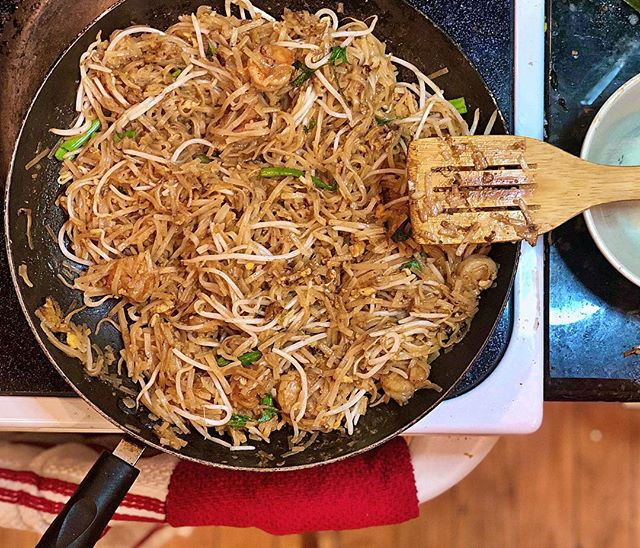
Find the location of a particular element. wooden spatula is located at coordinates (564, 184).